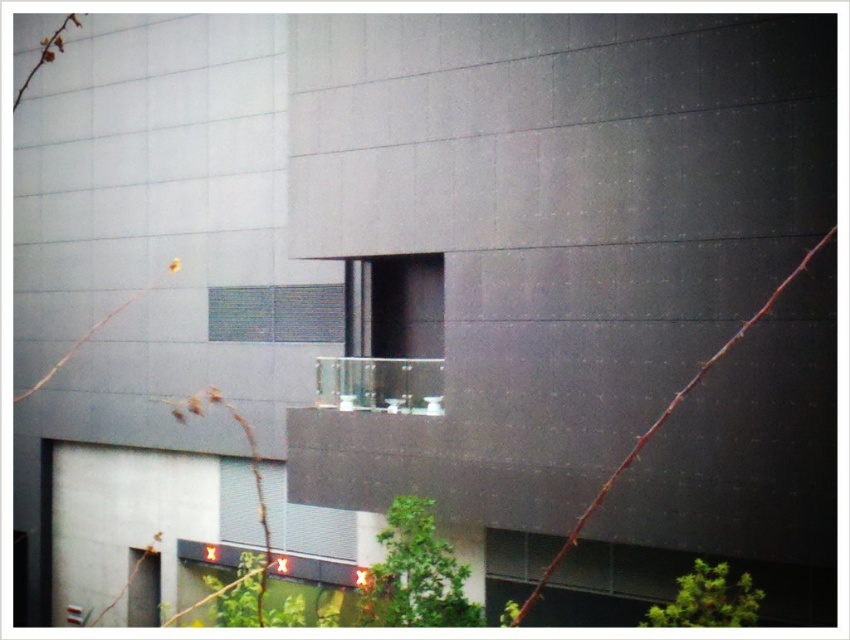
You are standing outside the building and looking at the transparent glass window at center and the clear glass balcony at center. Which one is taller?

The transparent glass window at center is taller than the clear glass balcony at center.

You are standing in front of the modern architectural structure described. You notice a point labeled as point (306, 522). Based on the scene description, what object does this point most likely represent?

The point (306, 522) corresponds to the clear glass window at lower center.

Based on the photo, you are an architect reviewing the building design and want to ensure that the clear glass window at lower center and the translucent glass window at center are positioned correctly. Based on the provided description, which window is closer to the observer when looking at the building facade?

The clear glass window at lower center is closer to the observer because it is described as being further to the viewer than the translucent glass window at center.